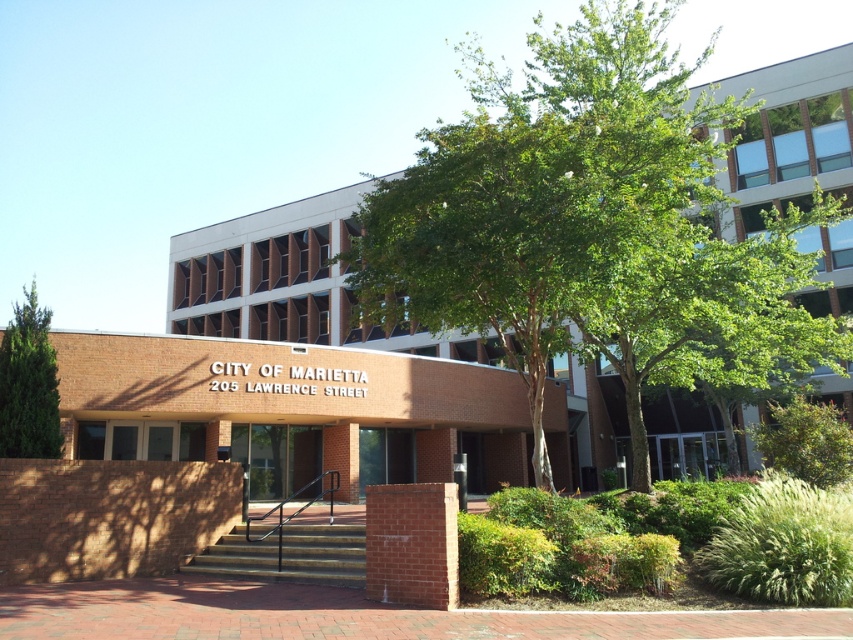
Between point (244, 538) and point (4, 442), which one is positioned behind?

Positioned behind is point (244, 538).

The width and height of the screenshot is (853, 640). Find the location of `concrete steps at center`. concrete steps at center is located at coordinates (x=288, y=554).

The image size is (853, 640). Find the location of `concrete steps at center`. concrete steps at center is located at coordinates (288, 554).

Image resolution: width=853 pixels, height=640 pixels. What do you see at coordinates (583, 220) in the screenshot?
I see `green leafy tree at center` at bounding box center [583, 220].

Between point (579, 298) and point (198, 561), which one is positioned in front?

Point (579, 298)

This screenshot has width=853, height=640. In order to click on green leafy tree at center in this screenshot , I will do `click(583, 220)`.

Does green leafy tree at center appear on the right side of green leafy tree at left?

Yes, green leafy tree at center is to the right of green leafy tree at left.

The height and width of the screenshot is (640, 853). Describe the element at coordinates (583, 220) in the screenshot. I see `green leafy tree at center` at that location.

Which is behind, point (653, 125) or point (15, 448)?

The point (15, 448) is behind.

Locate an element on the screen. Image resolution: width=853 pixels, height=640 pixels. green leafy tree at center is located at coordinates (583, 220).